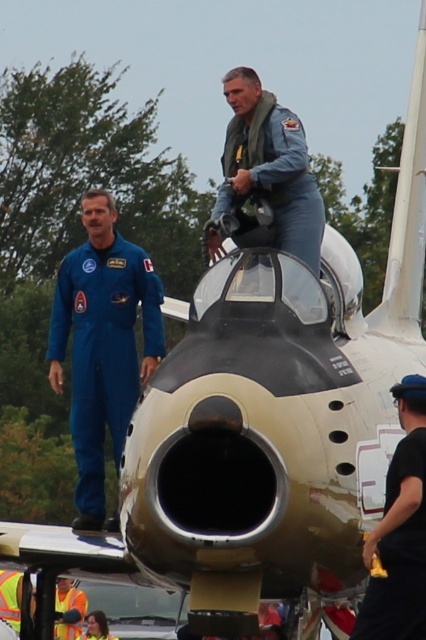
Can you confirm if blue denim jumpsuit at center is smaller than high visibility vest at lower left?

Correct, blue denim jumpsuit at center occupies less space than high visibility vest at lower left.

Is blue denim jumpsuit at center closer to the viewer compared to high visibility vest at lower left?

Yes.

Is point (296, 161) positioned after point (81, 605)?

That is False.

Locate an element on the screen. This screenshot has width=426, height=640. blue denim jumpsuit at center is located at coordinates (268, 168).

This screenshot has height=640, width=426. What are the coordinates of `blue smooth jumpsuit at left` in the screenshot? It's located at (103, 342).

Looking at this image, is blue smooth jumpsuit at left thinner than black matte helmet at upper center?

Incorrect, blue smooth jumpsuit at left's width is not less than black matte helmet at upper center's.

Is point (149, 362) closer to camera compared to point (380, 532)?

No, it is behind (380, 532).

You are a GUI agent. You are given a task and a screenshot of the screen. Output one action in this format:
    pyautogui.click(x=<x>, y=<y>)
    Task: Click on the blue smooth jumpsuit at left
    This screenshot has width=426, height=640.
    Given the screenshot: What is the action you would take?
    pyautogui.click(x=103, y=342)

Looking at this image, does blue denim jumpsuit at center have a smaller size compared to black matte helmet at upper center?

Incorrect, blue denim jumpsuit at center is not smaller in size than black matte helmet at upper center.

Is blue denim jumpsuit at center positioned at the back of black matte helmet at upper center?

Yes.

The height and width of the screenshot is (640, 426). Find the location of `blue denim jumpsuit at center`. blue denim jumpsuit at center is located at coordinates (268, 168).

Where is `blue denim jumpsuit at center`? The image size is (426, 640). blue denim jumpsuit at center is located at coordinates (268, 168).